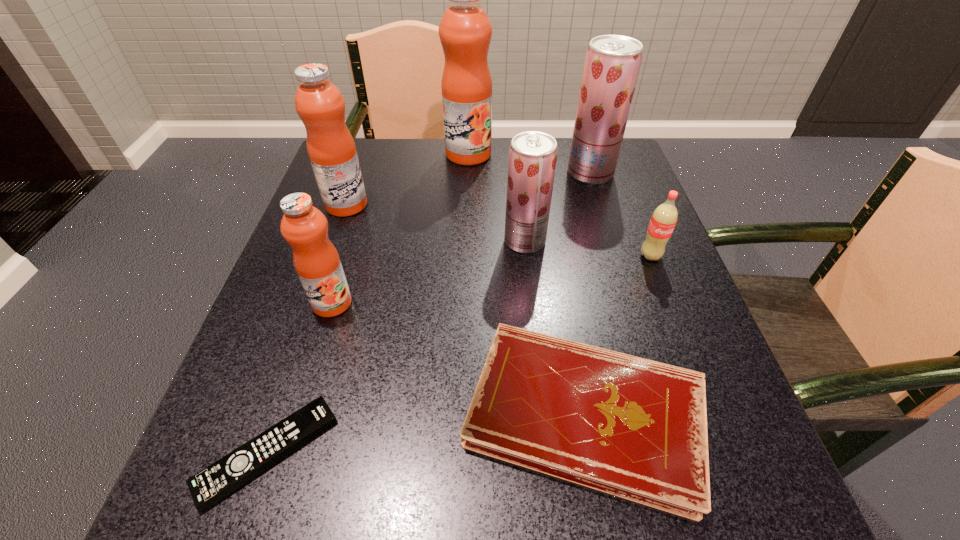
Identify which fruit juice is the fourth nearest to the fourth fruit juice from left to right. Please provide its 2D coordinates. Your answer should be formatted as a tuple, i.e. [(x, y)], where the tuple contains the x and y coordinates of a point satisfying the conditions above.

[(319, 103)]

Where is `orange fruit juice identified as the closest to the notebook`? orange fruit juice identified as the closest to the notebook is located at coordinates (305, 228).

Select which orange fruit juice is the closest to the second fruit juice from right to left. Please provide its 2D coordinates. Your answer should be formatted as a tuple, i.e. [(x, y)], where the tuple contains the x and y coordinates of a point satisfying the conditions above.

[(465, 31)]

Where is `vacant space that satisfies the following two spatial constraints: 1. on the front label of the shortest object; 2. on the right side of the second farthest orange fruit juice`? Image resolution: width=960 pixels, height=540 pixels. vacant space that satisfies the following two spatial constraints: 1. on the front label of the shortest object; 2. on the right side of the second farthest orange fruit juice is located at coordinates (260, 452).

Identify the location of free space that satisfies the following two spatial constraints: 1. on the front label of the nearer strawberry fruit juice; 2. on the left side of the tallest object. (466, 241).

You are a GUI agent. You are given a task and a screenshot of the screen. Output one action in this format:
    pyautogui.click(x=<x>, y=<y>)
    Task: Click on the vacant area in the image that satisfies the following two spatial constraints: 1. on the front side of the sixth tallest object; 2. on the right side of the right strawberry fruit juice
    The height and width of the screenshot is (540, 960).
    Given the screenshot: What is the action you would take?
    pyautogui.click(x=616, y=256)

Locate an element on the screen. free spot that satisfies the following two spatial constraints: 1. on the front label of the tallest fruit juice; 2. on the right side of the notebook is located at coordinates (459, 413).